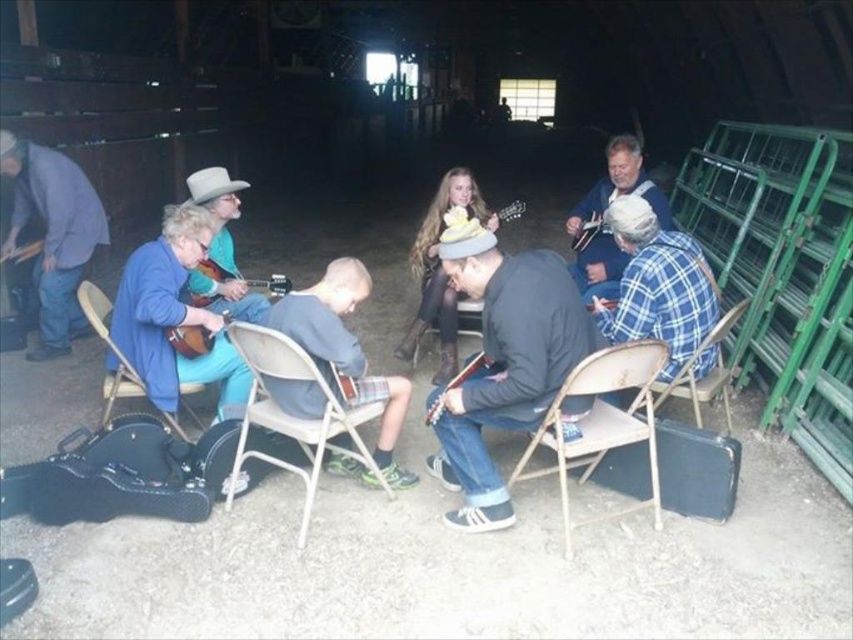
Find the location of a particular element. Image resolution: width=853 pixels, height=640 pixels. dark gray sweater at center is located at coordinates (502, 360).

You are a GUI agent. You are given a task and a screenshot of the screen. Output one action in this format:
    pyautogui.click(x=<x>, y=<y>)
    Task: Click on the dark gray sweater at center
    The width and height of the screenshot is (853, 640).
    Given the screenshot: What is the action you would take?
    pyautogui.click(x=502, y=360)

Which is more to the right, gray fabric shirt at center or blue plaid shirt at upper right?

From the viewer's perspective, blue plaid shirt at upper right appears more on the right side.

Who is lower down, gray fabric shirt at center or blue plaid shirt at upper right?

gray fabric shirt at center is lower down.

Based on the photo, measure the distance between point (264, 316) and camera.

The distance of point (264, 316) from camera is 2.72 meters.

Find the location of a particular element. The width and height of the screenshot is (853, 640). gray fabric shirt at center is located at coordinates [345, 353].

Does metallic silver folding chair at lower center have a lesser height compared to metallic silver chair at lower left?

Incorrect, metallic silver folding chair at lower center's height does not fall short of metallic silver chair at lower left's.

Who is more distant from viewer, (550, 468) or (90, 320)?

Point (90, 320)

At what (x,y) coordinates should I click in order to perform the action: click on metallic silver folding chair at lower center. Please return your answer as a coordinate pair (x, y). The image size is (853, 640). Looking at the image, I should click on (601, 426).